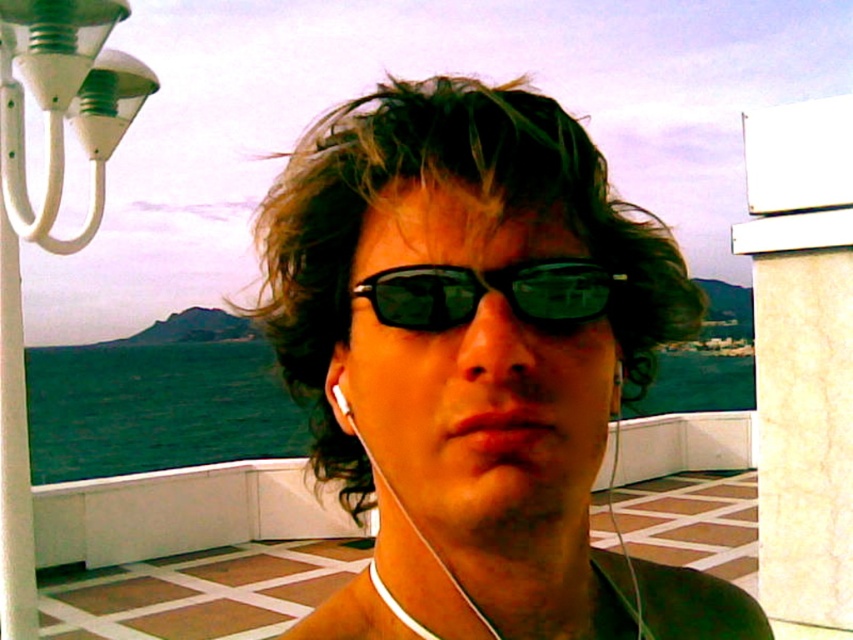
You are a photographer taking a portrait of the person in the scene. You notice the dark curly hair at center and the green reflective plastic goggles at center. Which object takes up more space horizontally in the photo?

The dark curly hair at center takes up more space horizontally in the photo because its width surpasses that of the green reflective plastic goggles at center.